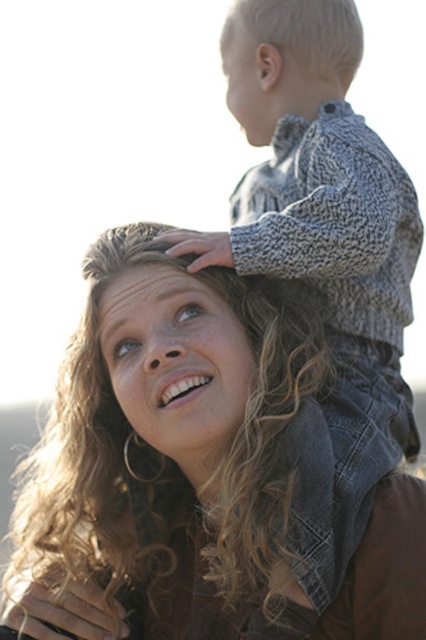
Question: From the image, what is the correct spatial relationship of curly blonde hair at upper center in relation to knitted gray sweater at upper right?

Choices:
 (A) left
 (B) right

Answer: (A)

Question: Which object is positioned farthest from the blonde hair at center?

Choices:
 (A) knitted gray sweater at upper right
 (B) curly blonde hair at upper center

Answer: (A)

Question: Is blonde hair at center to the right of knitted gray sweater at upper right from the viewer's perspective?

Choices:
 (A) yes
 (B) no

Answer: (B)

Question: Considering the real-world distances, which object is closest to the knitted gray sweater at upper right?

Choices:
 (A) blonde hair at center
 (B) curly blonde hair at upper center

Answer: (A)

Question: Can you confirm if curly blonde hair at upper center is positioned to the right of knitted gray sweater at upper right?

Choices:
 (A) no
 (B) yes

Answer: (A)

Question: Among these objects, which one is nearest to the camera?

Choices:
 (A) curly blonde hair at upper center
 (B) blonde hair at center

Answer: (A)